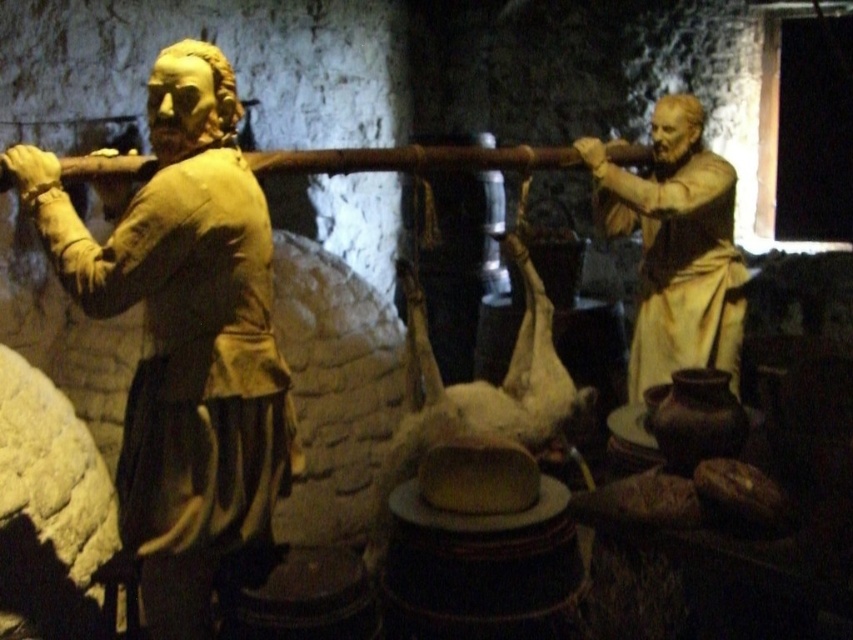
Which is more to the right, matte gold statue at left or matte gold statue at right?

matte gold statue at right

Between matte gold statue at left and matte gold statue at right, which one is positioned higher?

matte gold statue at right

The image size is (853, 640). I want to click on matte gold statue at left, so click(183, 336).

Find the location of a particular element. The image size is (853, 640). matte gold statue at left is located at coordinates (183, 336).